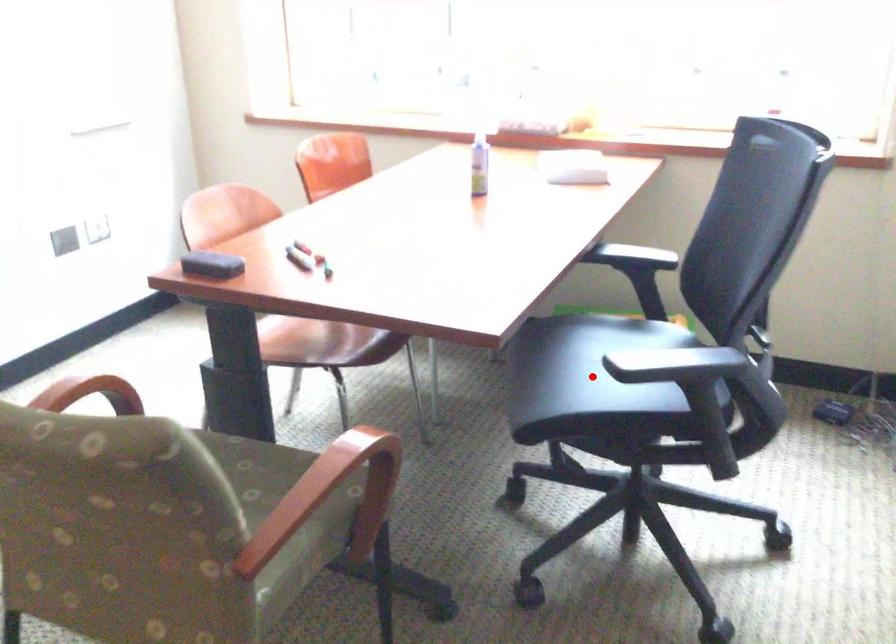
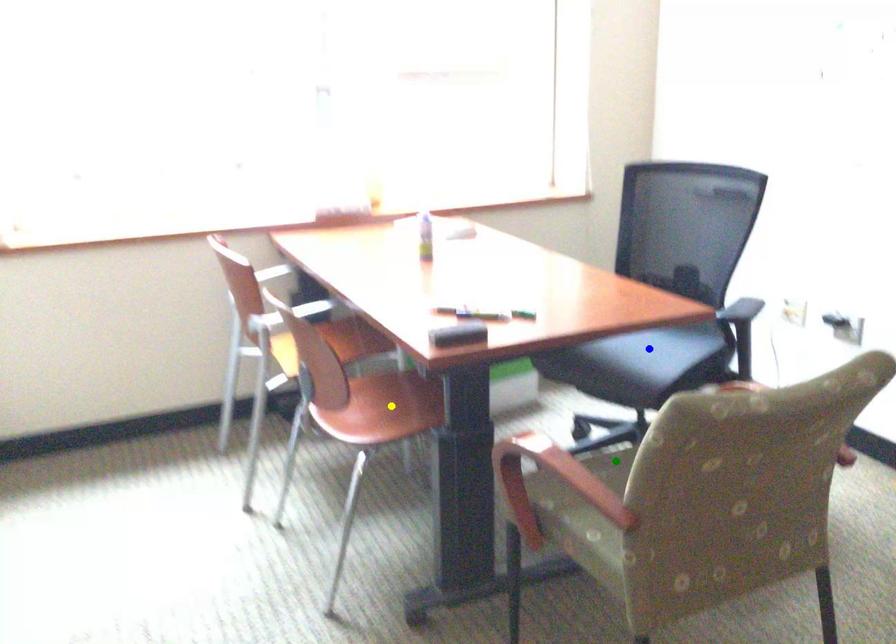
Question: I am providing you with two images of the same scene from different viewpoints. A red point is marked on the first image. You are given multiple points on the second image. In image 2, which mark is for the same physical point as the one in image 1?

Choices:
 (A) green point
 (B) blue point
 (C) yellow point

Answer: (B)